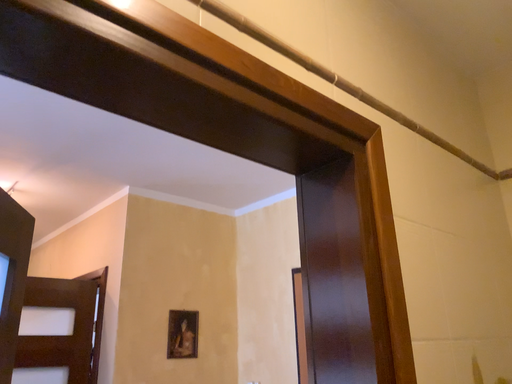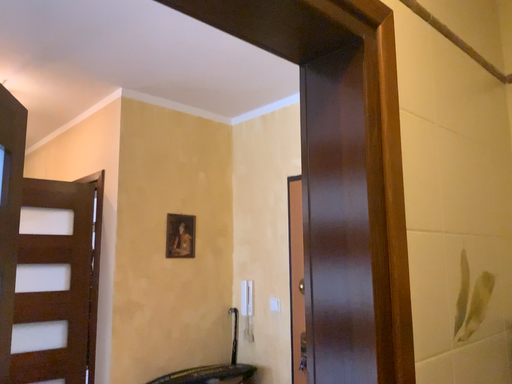
Question: How did the camera likely rotate when shooting the video?

Choices:
 (A) rotated downward
 (B) rotated upward

Answer: (A)